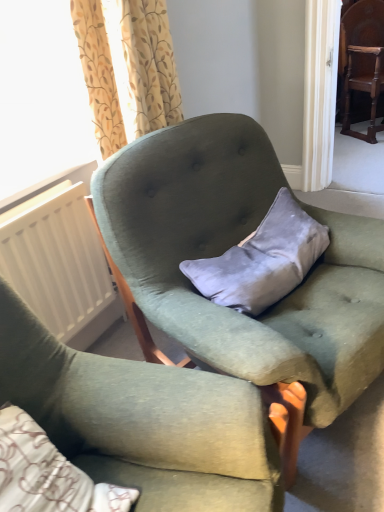
Question: Based on their sizes in the image, would you say white plastic radiator at left is bigger or smaller than dark brown wood chair at upper right, which appears as the first chair when viewed from the back?

Choices:
 (A) big
 (B) small

Answer: (B)

Question: Considering the positions of white plastic radiator at left and dark brown wood chair at upper right, which appears as the first chair when viewed from the back, in the image, is white plastic radiator at left taller or shorter than dark brown wood chair at upper right, which appears as the first chair when viewed from the back,?

Choices:
 (A) short
 (B) tall

Answer: (A)

Question: Which is nearer to the velvet green armchair at center, which ranks as the 2th chair in left-to-right order?

Choices:
 (A) dark brown wood chair at upper right, the 1th chair from the top
 (B) velvet gray pillow at center
 (C) white plastic radiator at left
 (D) floral-patterned fabric curtain at upper left
 (E) velvet green armchair at center, the 1th chair when ordered from front to back

Answer: (B)

Question: Based on their relative distances, which object is nearer to the dark brown wood chair at upper right, the third chair in the front-to-back sequence?

Choices:
 (A) floral-patterned fabric curtain at upper left
 (B) white plastic radiator at left
 (C) velvet green armchair at center, placed as the 3th chair when sorted from back to front
 (D) velvet gray pillow at center
 (E) velvet green armchair at center, placed as the second chair when sorted from back to front

Answer: (D)